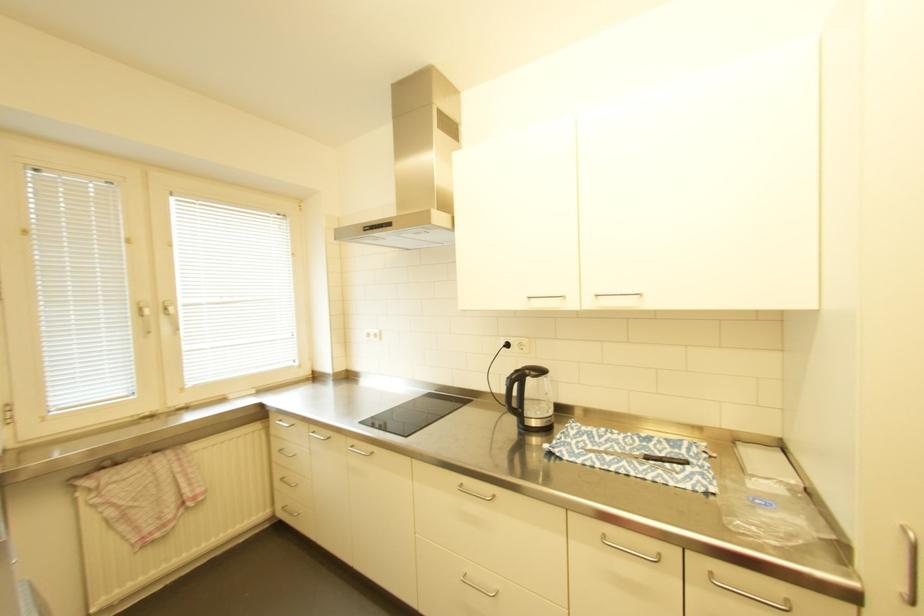
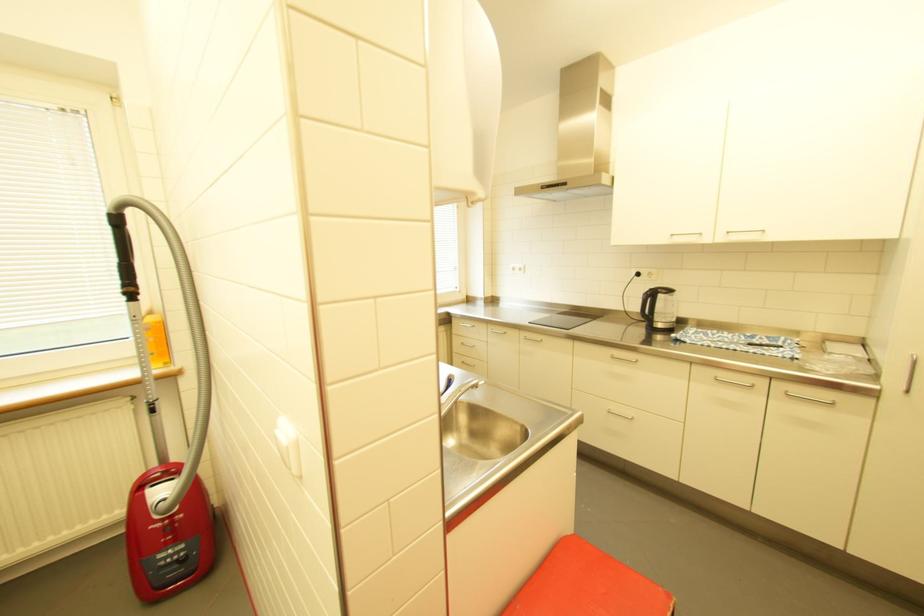
Where in the second image is the point corresponding to point 468,485 from the first image?

(621, 355)